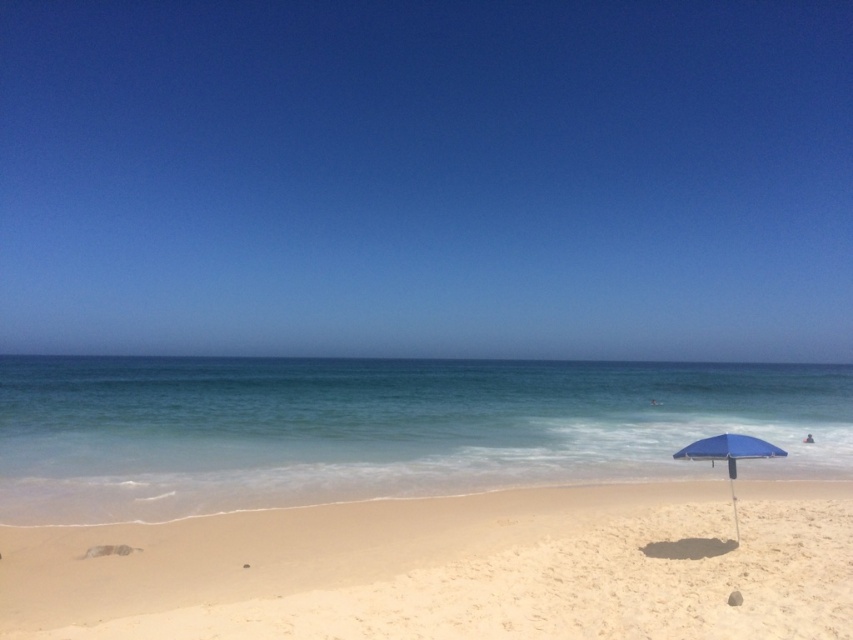
Consider the image. You are planning to build a sandcastle on the light beige sand at lower center. Considering the height of the sand and the water level of the clear blue water at center, do you think the sandcastle will stay dry during high tide?

The light beige sand at lower center is not as tall as the clear blue water at center, so during high tide, the water level might rise higher than the sand, causing the sandcastle to get wet.

You are standing on the beach and want to place a small cooler between the light beige sand at lower center and the blue fabric umbrella at lower right. Based on their positions, which direction should you move from the umbrella to place the cooler correctly?

The light beige sand at lower center is to the left of the blue fabric umbrella at lower right, so you should move to the left from the umbrella to place the cooler between them.